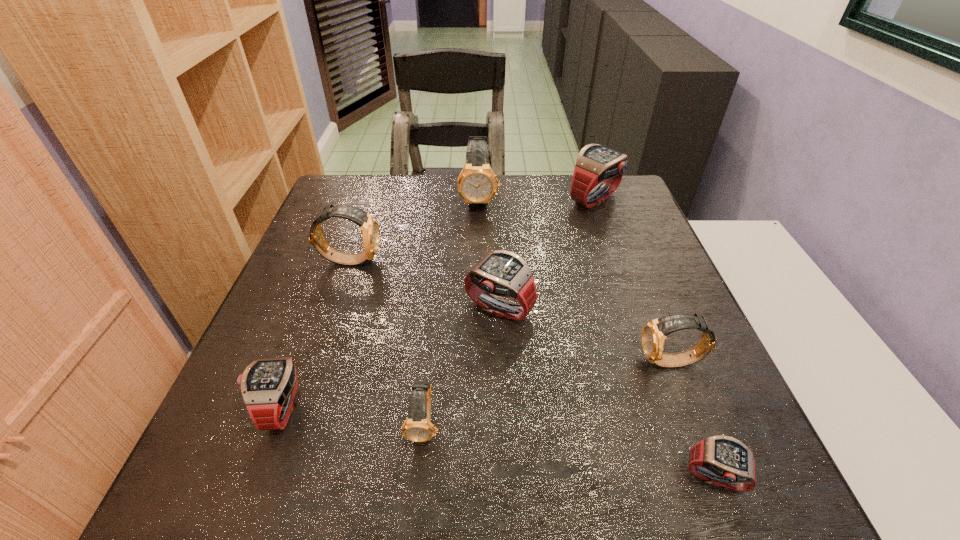
You are a GUI agent. You are given a task and a screenshot of the screen. Output one action in this format:
    pyautogui.click(x=<x>, y=<y>)
    Task: Click on the vacant space that is in between the fourth farthest watch and the third farthest object
    Image resolution: width=960 pixels, height=540 pixels.
    Given the screenshot: What is the action you would take?
    pyautogui.click(x=424, y=285)

In order to click on free spot between the tallest watch and the second smallest gold watch in this screenshot , I will do `click(575, 281)`.

The height and width of the screenshot is (540, 960). I want to click on object that is the second closest to the biggest red watch, so click(501, 274).

Where is `object that stands as the closest to the tallest watch`? The height and width of the screenshot is (540, 960). object that stands as the closest to the tallest watch is located at coordinates (596, 164).

Identify the location of watch object that ranks as the third closest to the biggest red watch. Image resolution: width=960 pixels, height=540 pixels. (654, 332).

Locate which watch ranks fifth in proximity to the third smallest red watch. Please provide its 2D coordinates. Your answer should be formatted as a tuple, i.e. [(x, y)], where the tuple contains the x and y coordinates of a point satisfying the conditions above.

[(268, 386)]

Select which gold watch appears as the closest to the nearest red watch. Please provide its 2D coordinates. Your answer should be formatted as a tuple, i.e. [(x, y)], where the tuple contains the x and y coordinates of a point satisfying the conditions above.

[(654, 332)]

Select which gold watch is the closest to the second smallest red watch. Please provide its 2D coordinates. Your answer should be formatted as a tuple, i.e. [(x, y)], where the tuple contains the x and y coordinates of a point satisfying the conditions above.

[(417, 427)]

Identify the location of red watch that can be found as the closest to the third biggest gold watch. The image size is (960, 540). (721, 460).

Image resolution: width=960 pixels, height=540 pixels. Find the location of `the closest red watch relative to the leftmost gold watch`. the closest red watch relative to the leftmost gold watch is located at coordinates (501, 274).